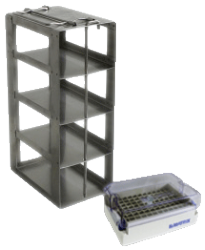
Where is `top shelf`? Image resolution: width=205 pixels, height=250 pixels. top shelf is located at coordinates (70, 60).